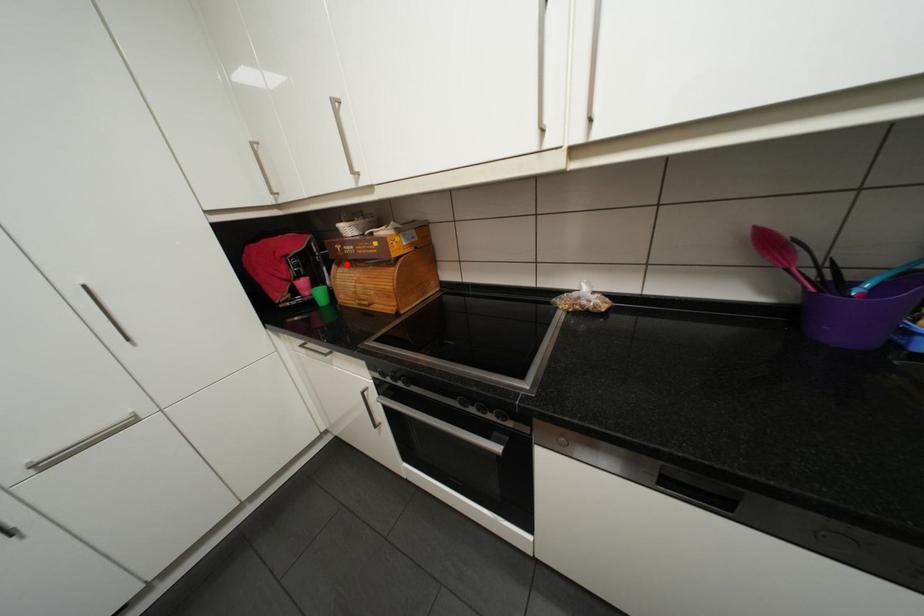
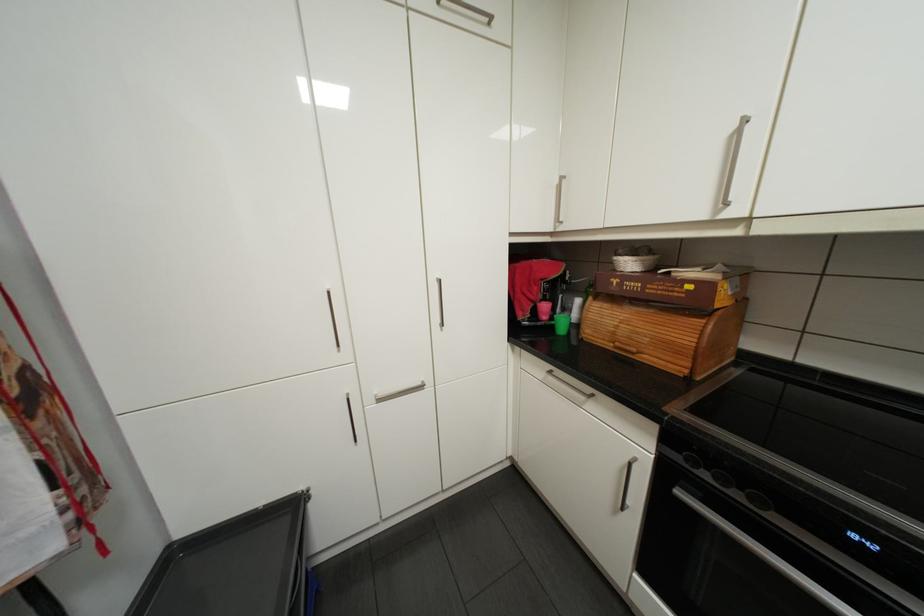
Locate, in the second image, the point that corresponds to the highlighted location in the first image.

(602, 297)